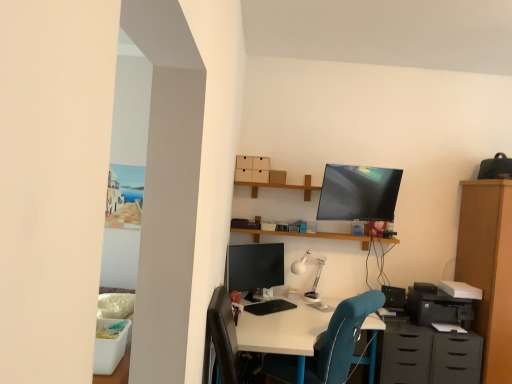
Question: Considering the relative sizes of wooden shelf at upper center and matte black dresser at lower right in the image provided, is wooden shelf at upper center wider than matte black dresser at lower right?

Choices:
 (A) no
 (B) yes

Answer: (A)

Question: Is wooden shelf at upper center at the left side of matte black dresser at lower right?

Choices:
 (A) no
 (B) yes

Answer: (B)

Question: Can you confirm if wooden shelf at upper center is taller than matte black dresser at lower right?

Choices:
 (A) yes
 (B) no

Answer: (B)

Question: Is wooden shelf at upper center looking in the opposite direction of matte black dresser at lower right?

Choices:
 (A) no
 (B) yes

Answer: (A)

Question: Could you tell me if wooden shelf at upper center is turned towards matte black dresser at lower right?

Choices:
 (A) no
 (B) yes

Answer: (A)

Question: Is wooden shelf at upper center far away from matte black dresser at lower right?

Choices:
 (A) no
 (B) yes

Answer: (A)

Question: Is matte black monitor at center further to the viewer compared to teal fabric chair at center?

Choices:
 (A) no
 (B) yes

Answer: (B)

Question: Considering the relative sizes of matte black monitor at center and teal fabric chair at center in the image provided, is matte black monitor at center taller than teal fabric chair at center?

Choices:
 (A) yes
 (B) no

Answer: (B)

Question: Considering the relative sizes of matte black monitor at center and teal fabric chair at center in the image provided, is matte black monitor at center bigger than teal fabric chair at center?

Choices:
 (A) yes
 (B) no

Answer: (B)

Question: From a real-world perspective, is matte black monitor at center over teal fabric chair at center?

Choices:
 (A) yes
 (B) no

Answer: (A)

Question: Can you confirm if matte black monitor at center is thinner than teal fabric chair at center?

Choices:
 (A) yes
 (B) no

Answer: (A)

Question: Is matte black monitor at center outside teal fabric chair at center?

Choices:
 (A) yes
 (B) no

Answer: (A)

Question: From the image's perspective, is matte black monitor at center on white matte desk lamp at center?

Choices:
 (A) yes
 (B) no

Answer: (A)